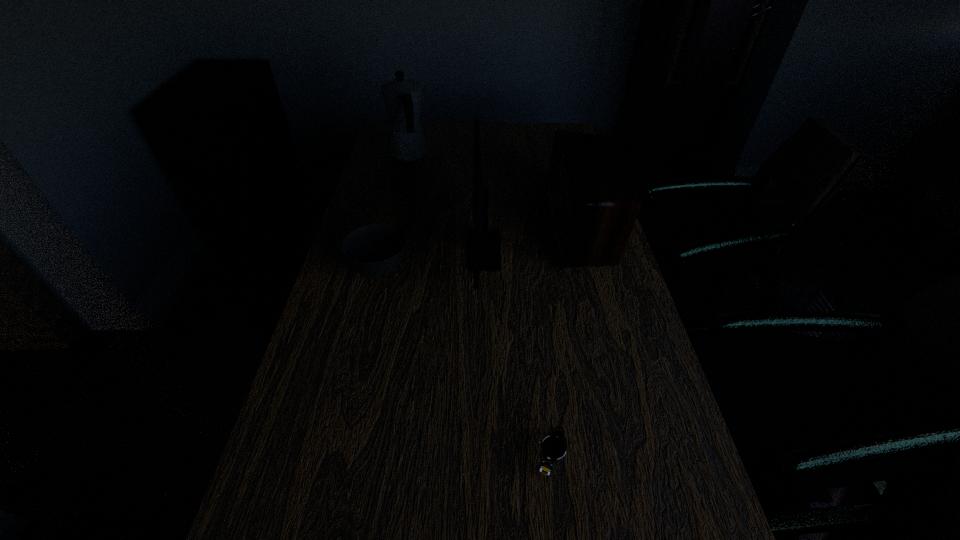
The width and height of the screenshot is (960, 540). Find the location of `vacant area that lies between the farthest object and the computer monitor`. vacant area that lies between the farthest object and the computer monitor is located at coordinates (446, 202).

Find the location of a particular element. free space between the farthest object and the rightmost object is located at coordinates (494, 192).

Image resolution: width=960 pixels, height=540 pixels. I want to click on vacant space in between the coffeepot and the rightmost object, so click(x=494, y=192).

Find the location of a particular element. free point between the coffeepot and the computer monitor is located at coordinates (446, 202).

Identify the location of empty space that is in between the radio receiver and the third object from right to left. Image resolution: width=960 pixels, height=540 pixels. (533, 239).

The width and height of the screenshot is (960, 540). What are the coordinates of `object that is the fourth closest to the radio receiver` in the screenshot? It's located at (553, 448).

Find the location of a particular element. object that can be found as the fourth closest to the third object from right to left is located at coordinates (553, 448).

This screenshot has height=540, width=960. In order to click on vacant space that satisfies the following two spatial constraints: 1. on the screen side of the third object from right to left; 2. on the left side of the shortest object in this screenshot , I will do click(x=488, y=455).